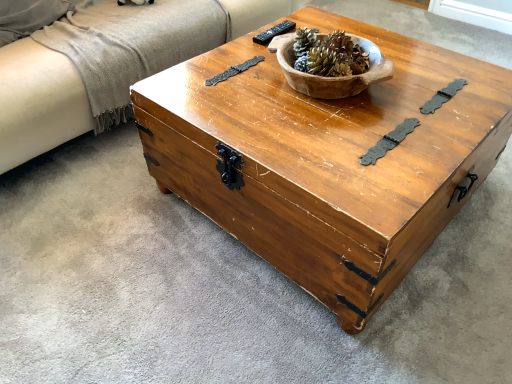
What do you see at coordinates (274, 32) in the screenshot? Image resolution: width=512 pixels, height=384 pixels. I see `black plastic remote at upper center` at bounding box center [274, 32].

Image resolution: width=512 pixels, height=384 pixels. What do you see at coordinates (328, 54) in the screenshot? I see `wooden bowl at center` at bounding box center [328, 54].

Locate an element on the screen. wooden bowl at center is located at coordinates (328, 54).

What do you see at coordinates (38, 102) in the screenshot?
I see `beige fabric couch at left` at bounding box center [38, 102].

Locate an element on the screen. Image resolution: width=512 pixels, height=384 pixels. wooden chest at center is located at coordinates (327, 159).

Measure the distance between beige fabric couch at left and black plastic remote at upper center.

They are 31.48 inches apart.

Which is nearer, (265, 14) or (285, 21)?

Positioned in front is point (285, 21).

Is beige fabric couch at left wider than black plastic remote at upper center?

Yes, beige fabric couch at left is wider than black plastic remote at upper center.

Consider the image. From a real-world perspective, which object rests below the other?

beige fabric couch at left, from a real-world perspective.

Does wooden chest at center appear on the left side of beige fabric couch at left?

In fact, wooden chest at center is to the right of beige fabric couch at left.

Is wooden chest at center positioned far away from beige fabric couch at left?

That's not correct — wooden chest at center is a little close to beige fabric couch at left.

How different are the orientations of wooden chest at center and beige fabric couch at left in degrees?

Answer: The angle between the facing direction of wooden chest at center and the facing direction of beige fabric couch at left is 89 degrees.

Considering the relative sizes of wooden bowl at center and beige fabric couch at left in the image provided, is wooden bowl at center shorter than beige fabric couch at left?

Yes, wooden bowl at center is shorter than beige fabric couch at left.

Is wooden bowl at center with beige fabric couch at left?

wooden bowl at center and beige fabric couch at left are clearly separated.

Relative to beige fabric couch at left, is wooden bowl at center in front or behind?

In the image, wooden bowl at center appears in front of beige fabric couch at left.

Between wooden bowl at center and beige fabric couch at left, which one has smaller width?

wooden bowl at center is thinner.

Is wooden chest at center far away from black plastic remote at upper center?

wooden chest at center is near black plastic remote at upper center, not far away.

Is wooden chest at center positioned in front of black plastic remote at upper center?

That is True.

From the image's perspective, between wooden chest at center and black plastic remote at upper center, who is located below?

wooden chest at center appears lower in the image.

Is wooden chest at center to the left or to the right of black plastic remote at upper center in the image?

In the image, wooden chest at center appears on the right side of black plastic remote at upper center.

Considering the relative sizes of wooden bowl at center and wooden chest at center in the image provided, is wooden bowl at center taller than wooden chest at center?

Incorrect, the height of wooden bowl at center is not larger of that of wooden chest at center.

Find the location of a particular element. The image size is (512, 384). coffee table on the right of the wooden bowl at center is located at coordinates (327, 159).

Is wooden bowl at center thinner than wooden chest at center?

Indeed, wooden bowl at center has a lesser width compared to wooden chest at center.

Considering the positions of objects wooden bowl at center and wooden chest at center in the image provided, who is behind, wooden bowl at center or wooden chest at center?

wooden bowl at center is further from the camera.

Is black plastic remote at upper center next to beige fabric couch at left?

No, black plastic remote at upper center is not in contact with beige fabric couch at left.

Which of these two, black plastic remote at upper center or beige fabric couch at left, stands shorter?

Standing shorter between the two is black plastic remote at upper center.

What's the angular difference between black plastic remote at upper center and beige fabric couch at left's facing directions?

black plastic remote at upper center and beige fabric couch at left are facing 93.8 degrees away from each other.

From a real-world perspective, is black plastic remote at upper center positioned above or below beige fabric couch at left?

In terms of real-world spatial position, black plastic remote at upper center is above beige fabric couch at left.

Does wooden chest at center contain wooden bowl at center?

No, wooden bowl at center is not inside wooden chest at center.

Is wooden chest at center positioned behind wooden bowl at center?

No, the depth of wooden chest at center is less than that of wooden bowl at center.

Can you confirm if wooden chest at center is positioned to the right of wooden bowl at center?

Yes.

The height and width of the screenshot is (384, 512). There is a beige fabric couch at left. Identify the location of remote above it (from a real-world perspective). (274, 32).

You are a GUI agent. You are given a task and a screenshot of the screen. Output one action in this format:
    pyautogui.click(x=<x>, y=<y>)
    Task: Click on the couch above the wooden chest at center (from the image's perspective)
    The height and width of the screenshot is (384, 512).
    Given the screenshot: What is the action you would take?
    pyautogui.click(x=38, y=102)

When comparing their distances from black plastic remote at upper center, does wooden chest at center or wooden bowl at center seem closer?

Based on the image, wooden bowl at center appears to be nearer to black plastic remote at upper center.

Based on their spatial positions, is black plastic remote at upper center or beige fabric couch at left closer to wooden chest at center?

black plastic remote at upper center.

Looking at the image, which one is located further to wooden bowl at center, black plastic remote at upper center or beige fabric couch at left?

beige fabric couch at left is further to wooden bowl at center.

Which object lies further to the anchor point black plastic remote at upper center, wooden chest at center or beige fabric couch at left?

beige fabric couch at left is positioned further to the anchor black plastic remote at upper center.

When comparing their distances from beige fabric couch at left, does wooden chest at center or black plastic remote at upper center seem further?

Among the two, wooden chest at center is located further to beige fabric couch at left.

Looking at the image, which one is located further to beige fabric couch at left, wooden bowl at center or wooden chest at center?

The object further to beige fabric couch at left is wooden bowl at center.

From the image, which object appears to be farther from wooden bowl at center, wooden chest at center or beige fabric couch at left?

Among the two, beige fabric couch at left is located further to wooden bowl at center.

Estimate the real-world distances between objects in this image. Which object is closer to black plastic remote at upper center, beige fabric couch at left or wooden bowl at center?

Based on the image, wooden bowl at center appears to be nearer to black plastic remote at upper center.

Image resolution: width=512 pixels, height=384 pixels. I want to click on centerpiece between wooden chest at center and black plastic remote at upper center along the z-axis, so click(328, 54).

Locate an element on the screen. This screenshot has height=384, width=512. remote between beige fabric couch at left and wooden bowl at center in the horizontal direction is located at coordinates (274, 32).

At what (x,y) coordinates should I click in order to perform the action: click on centerpiece between beige fabric couch at left and wooden chest at center from left to right. Please return your answer as a coordinate pair (x, y). Looking at the image, I should click on (328, 54).

Identify the location of remote between beige fabric couch at left and wooden chest at center in the horizontal direction. The height and width of the screenshot is (384, 512). pos(274,32).